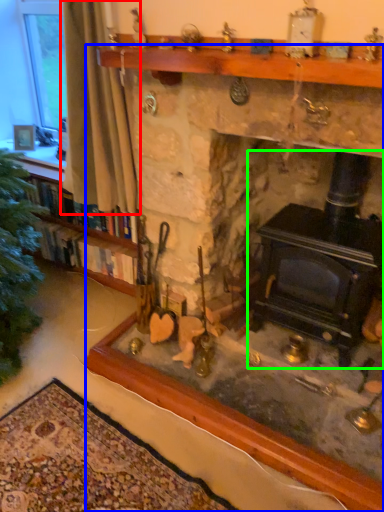
Question: Which object is positioned closest to curtain (highlighted by a red box)? Select from fireplace (highlighted by a blue box) and wood burning stove (highlighted by a green box).

Choices:
 (A) fireplace
 (B) wood burning stove

Answer: (B)